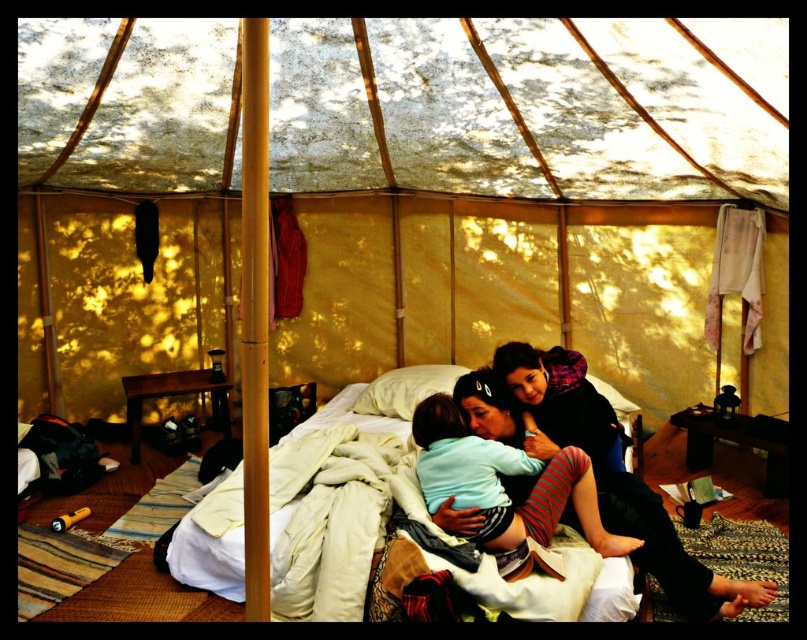
Is transparent fabric canopy at upper center taller than light blue fabric at center?

Correct, transparent fabric canopy at upper center is much taller as light blue fabric at center.

This screenshot has height=640, width=807. What do you see at coordinates (532, 108) in the screenshot?
I see `transparent fabric canopy at upper center` at bounding box center [532, 108].

Who is more forward, (x=567, y=106) or (x=538, y=515)?

Point (x=538, y=515) is in front.

Locate an element on the screen. This screenshot has width=807, height=640. transparent fabric canopy at upper center is located at coordinates (532, 108).

Can you confirm if transparent fabric canopy at upper center is positioned above matte black sweater at center?

Yes.

Is transparent fabric canopy at upper center smaller than matte black sweater at center?

No, transparent fabric canopy at upper center is not smaller than matte black sweater at center.

Between point (617, 184) and point (578, 371), which one is positioned behind?

The point (617, 184) is behind.

This screenshot has width=807, height=640. In order to click on transparent fabric canopy at upper center in this screenshot , I will do `click(532, 108)`.

Is light blue fabric at center shorter than white soft pillow at center?

No, light blue fabric at center is not shorter than white soft pillow at center.

Which is behind, point (559, 502) or point (458, 365)?

Point (458, 365)

Locate an element on the screen. The width and height of the screenshot is (807, 640). light blue fabric at center is located at coordinates (500, 484).

Find the location of `light blue fabric at center`. light blue fabric at center is located at coordinates click(x=500, y=484).